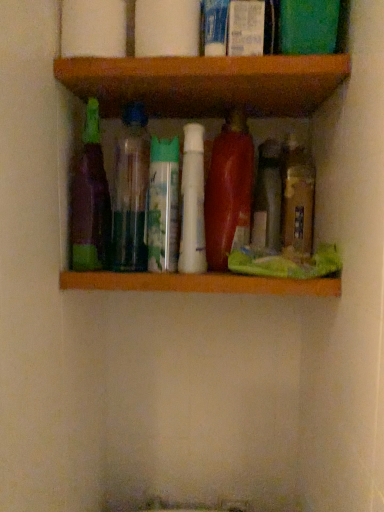
Question: Does shiny red plastic bottle at center, the third bottle from the right, have a larger size compared to white glossy lotion at upper center, which appears as the second toiletry when viewed from the left?

Choices:
 (A) yes
 (B) no

Answer: (A)

Question: From a real-world perspective, is shiny red plastic bottle at center, the third bottle from the right, beneath white glossy lotion at upper center, the 1th toiletry in the right-to-left sequence?

Choices:
 (A) no
 (B) yes

Answer: (B)

Question: From the image's perspective, is shiny red plastic bottle at center, the third bottle from the right, above white glossy lotion at upper center, which appears as the second toiletry when viewed from the left?

Choices:
 (A) no
 (B) yes

Answer: (A)

Question: Is white glossy lotion at upper center, which appears as the second toiletry when viewed from the left, surrounded by shiny red plastic bottle at center, the third bottle from the right?

Choices:
 (A) yes
 (B) no

Answer: (B)

Question: Is shiny red plastic bottle at center, which is counted as the fourth bottle, starting from the left, facing away from white glossy lotion at upper center, the 1th toiletry in the right-to-left sequence?

Choices:
 (A) no
 (B) yes

Answer: (A)

Question: In terms of height, does white matte toilet paper at upper center, placed as the 1th toilet paper when sorted from right to left, look taller or shorter compared to white matte toilet paper at upper center, which is the 2th toilet paper in right-to-left order?

Choices:
 (A) tall
 (B) short

Answer: (A)

Question: Is white matte toilet paper at upper center, positioned as the second toilet paper in left-to-right order, spatially inside white matte toilet paper at upper center, which is the first toilet paper from left to right, or outside of it?

Choices:
 (A) inside
 (B) outside

Answer: (B)

Question: From the image's perspective, is white matte toilet paper at upper center, placed as the 1th toilet paper when sorted from right to left, above or below white matte toilet paper at upper center, which is the first toilet paper from left to right?

Choices:
 (A) below
 (B) above

Answer: (A)

Question: In the image, is white matte toilet paper at upper center, placed as the 1th toilet paper when sorted from right to left, on the left side or the right side of white matte toilet paper at upper center, which is the 2th toilet paper in right-to-left order?

Choices:
 (A) right
 (B) left

Answer: (A)

Question: From their relative heights in the image, would you say translucent plastic bottle at center, which is the 5th bottle from left to right, is taller or shorter than translucent plastic bottle at center, which appears as the 6th bottle when viewed from the left?

Choices:
 (A) tall
 (B) short

Answer: (B)

Question: Is point (264, 187) closer or farther from the camera than point (291, 224)?

Choices:
 (A) farther
 (B) closer

Answer: (A)

Question: From a real-world perspective, is translucent plastic bottle at center, which appears as the second bottle when viewed from the right, physically located above or below translucent plastic bottle at center, which appears as the 6th bottle when viewed from the left?

Choices:
 (A) below
 (B) above

Answer: (A)

Question: Would you say translucent plastic bottle at center, which is the 5th bottle from left to right, is inside or outside translucent plastic bottle at center, which appears as the 6th bottle when viewed from the left?

Choices:
 (A) outside
 (B) inside

Answer: (A)

Question: Is shiny red plastic bottle at center, which is counted as the fourth bottle, starting from the left, spatially inside white glossy lotion at upper center, the 1th toiletry in the right-to-left sequence, or outside of it?

Choices:
 (A) outside
 (B) inside

Answer: (A)

Question: Is point (213, 186) closer or farther from the camera than point (253, 46)?

Choices:
 (A) closer
 (B) farther

Answer: (B)